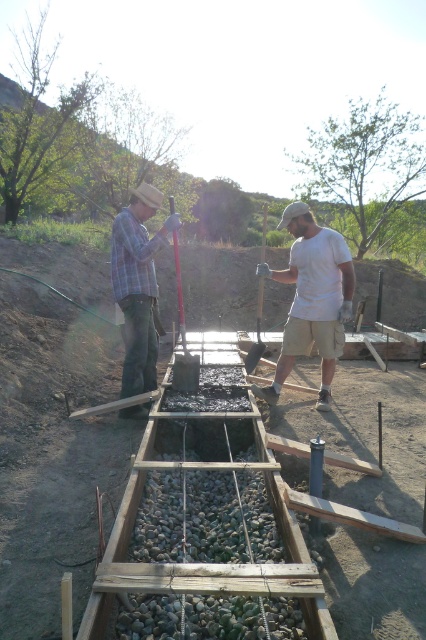
Is metallic silver shovel at center smaller than metallic shovel at center?

Indeed, metallic silver shovel at center has a smaller size compared to metallic shovel at center.

Who is lower down, metallic silver shovel at center or metallic shovel at center?

metallic silver shovel at center is lower down.

Who is more distant from viewer, (178, 381) or (261, 278)?

Positioned behind is point (261, 278).

Where is `metallic silver shovel at center`? The width and height of the screenshot is (426, 640). metallic silver shovel at center is located at coordinates (183, 340).

Between matte black concrete at center and metallic silver shovel at center, which one appears on the right side from the viewer's perspective?

From the viewer's perspective, matte black concrete at center appears more on the right side.

Which is in front, point (293, 259) or point (184, 337)?

Positioned in front is point (184, 337).

Where is `matte black concrete at center`? The height and width of the screenshot is (640, 426). matte black concrete at center is located at coordinates (313, 298).

This screenshot has width=426, height=640. Identify the location of matte black concrete at center. pos(313,298).

Is plaid fabric shirt at left shorter than metallic silver shovel at center?

Correct, plaid fabric shirt at left is not as tall as metallic silver shovel at center.

Does point (132, 356) come in front of point (172, 243)?

Yes, it is in front of point (172, 243).

What are the coordinates of `plaid fabric shirt at left` in the screenshot? It's located at [x=138, y=284].

The image size is (426, 640). Identify the location of plaid fabric shirt at left. (138, 284).